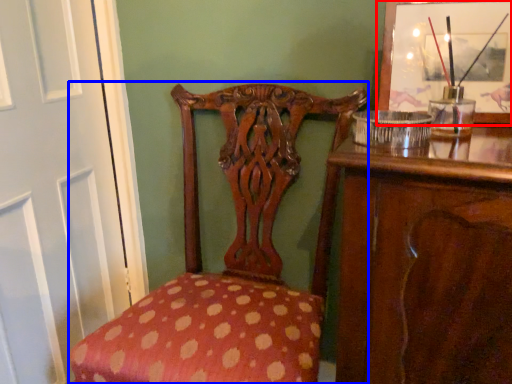
Question: Among these objects, which one is farthest to the camera, picture frame (highlighted by a red box) or chair (highlighted by a blue box)?

Choices:
 (A) picture frame
 (B) chair

Answer: (A)